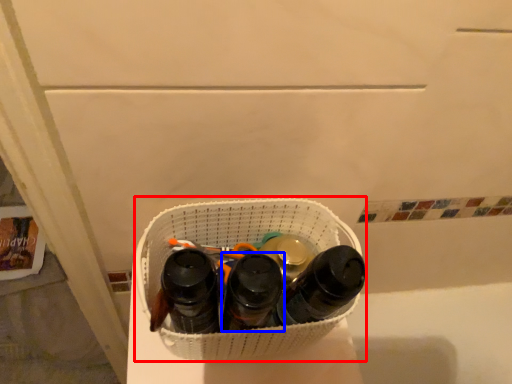
Question: Which of the following is the closest to the observer, laundry basket (highlighted by a red box) or footwear (highlighted by a blue box)?

Choices:
 (A) laundry basket
 (B) footwear

Answer: (B)